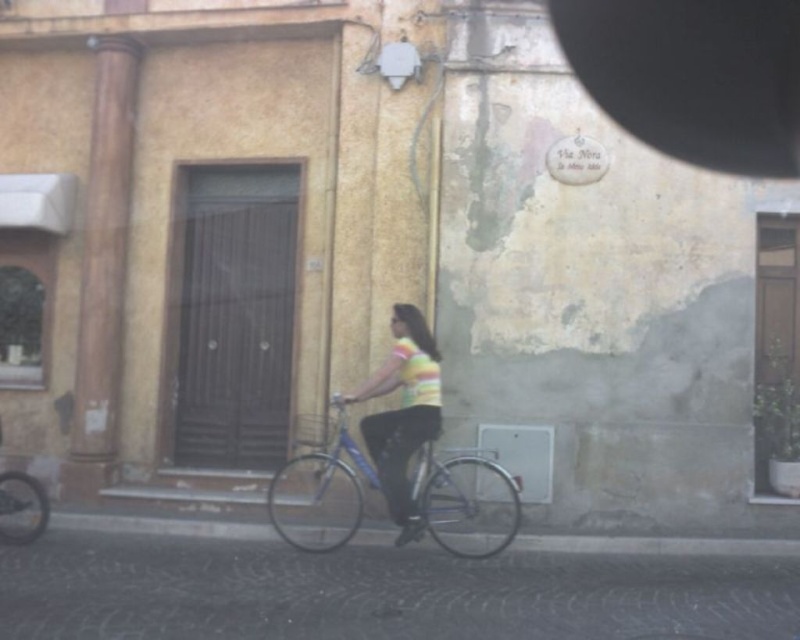
Question: Is blue metallic bicycle at center above striped fabric shirt at center?

Choices:
 (A) yes
 (B) no

Answer: (B)

Question: Which point is farther from the camera taking this photo?

Choices:
 (A) (433, 358)
 (B) (362, 497)

Answer: (B)

Question: Which point is farther from the camera taking this photo?

Choices:
 (A) (402, 358)
 (B) (494, 529)

Answer: (B)

Question: Which point is closer to the camera?

Choices:
 (A) (384, 492)
 (B) (322, 456)

Answer: (A)

Question: Is blue metallic bicycle at center to the left of striped fabric shirt at center from the viewer's perspective?

Choices:
 (A) no
 (B) yes

Answer: (B)

Question: Does blue metallic bicycle at center appear on the right side of striped fabric shirt at center?

Choices:
 (A) no
 (B) yes

Answer: (A)